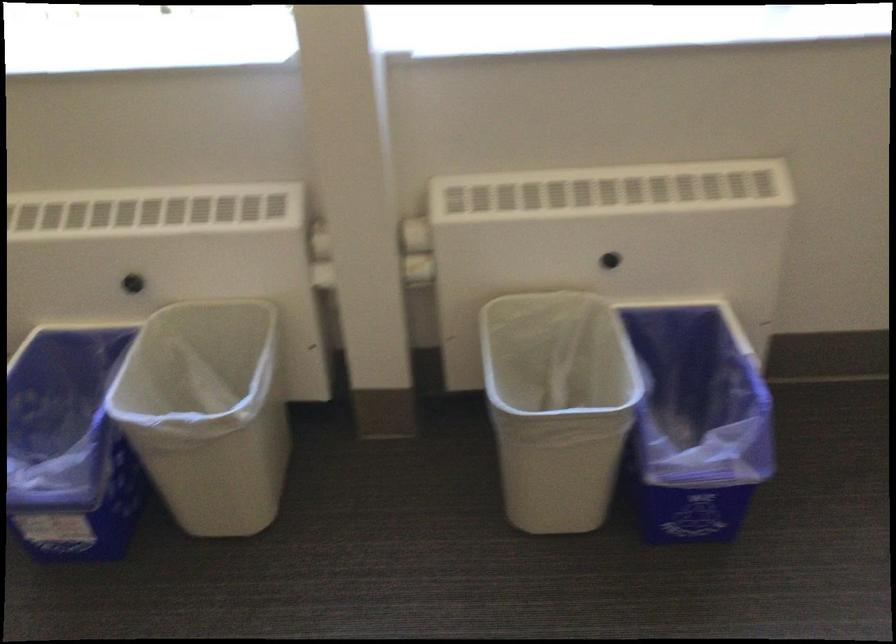
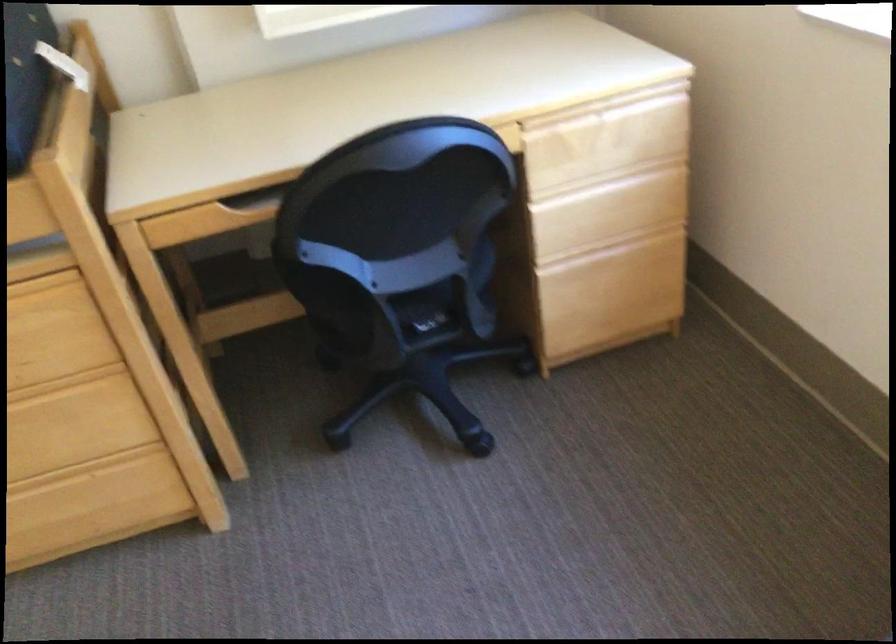
The images are taken continuously from a first-person perspective. In which direction is your viewpoint rotating?

The camera's rotation is toward left-down.